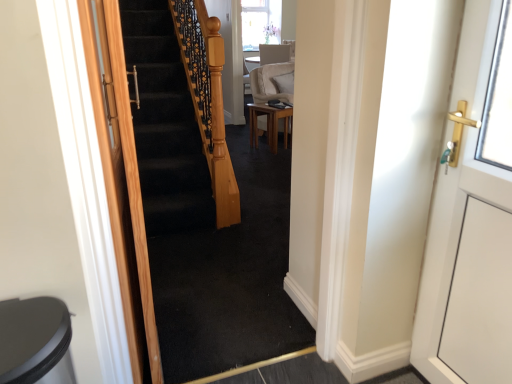
Where is `free point to the left of light brown wooden table at center`? This screenshot has width=512, height=384. free point to the left of light brown wooden table at center is located at coordinates (240, 145).